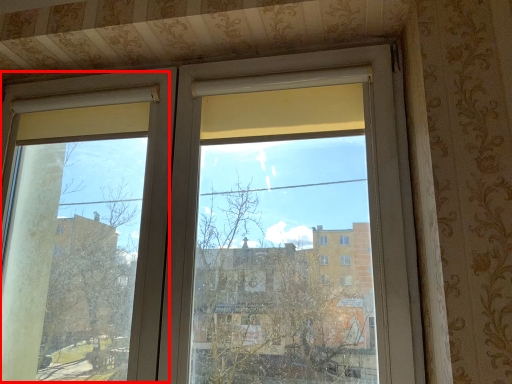
Question: From the image's perspective, what is the correct spatial positioning of screen door (annotated by the red box) in reference to window?

Choices:
 (A) above
 (B) below

Answer: (B)